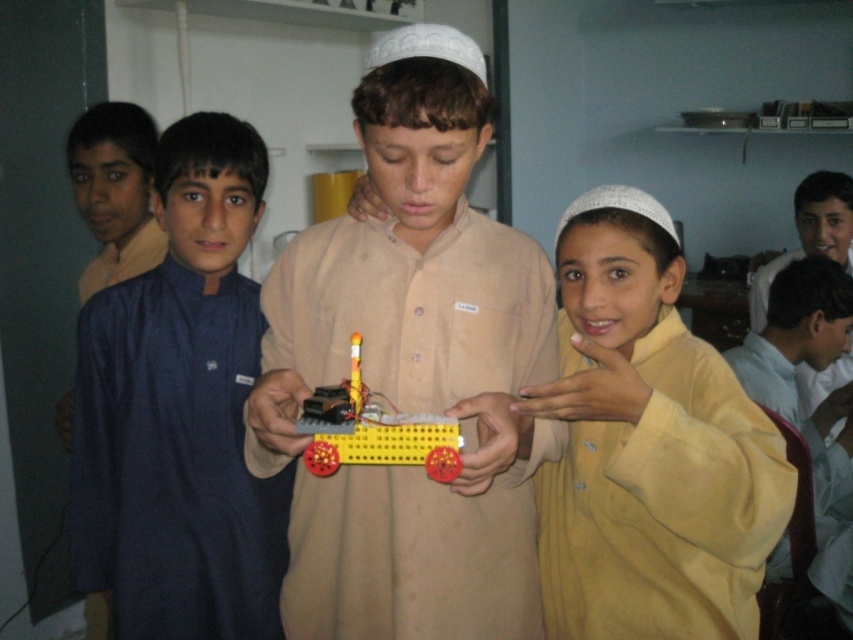
You are a photographer standing in front of the scene. You need to take a photo that includes both the yellow matte shirt at lower right and the yellow plastic toy at center. Which object should you adjust your camera angle to focus on first to ensure both are in frame?

The yellow matte shirt at lower right is taller than the yellow plastic toy at center, so you should focus on the taller object first to ensure both are in frame.